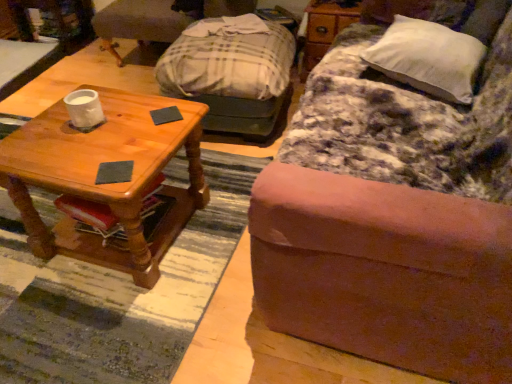
Identify the location of vacant space in front of white marble cup at center left. The height and width of the screenshot is (384, 512). (93, 147).